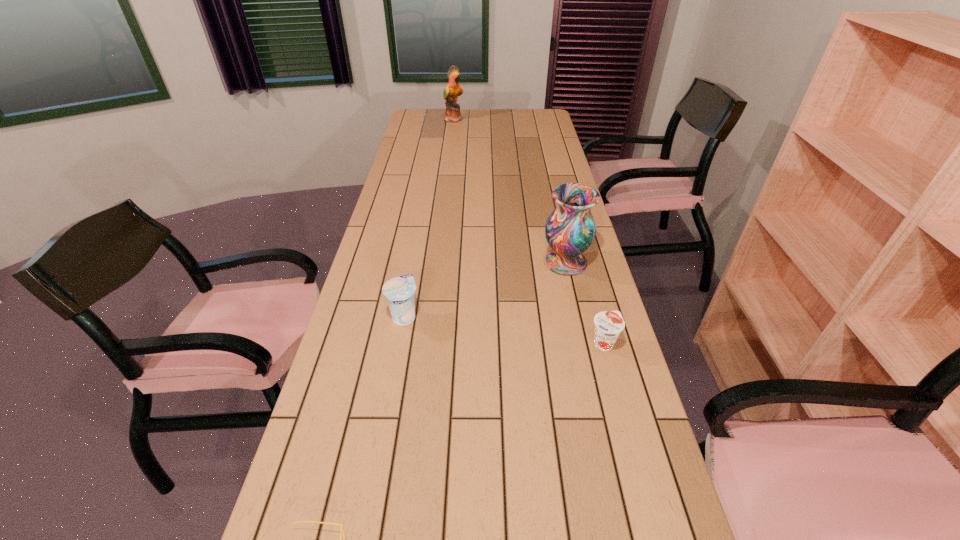
Locate an element on the screen. object positioned at the far edge is located at coordinates (453, 89).

The height and width of the screenshot is (540, 960). Find the location of `object situated at the left edge`. object situated at the left edge is located at coordinates (400, 291).

The height and width of the screenshot is (540, 960). In order to click on vase that is at the right edge in this screenshot , I will do `click(570, 229)`.

The image size is (960, 540). Find the location of `yogurt at the right edge`. yogurt at the right edge is located at coordinates (608, 324).

Identify the location of free spot at the far edge of the desktop. (491, 111).

This screenshot has height=540, width=960. Find the location of `free space at the left edge`. free space at the left edge is located at coordinates (365, 288).

In order to click on blank space at the right edge in this screenshot , I will do `click(588, 327)`.

Identify the location of vacant space at the far left corner. (423, 117).

I want to click on empty space that is in between the parrot and the left yogurt, so click(429, 218).

This screenshot has width=960, height=540. I want to click on free space between the farthest object and the second shortest object, so click(529, 231).